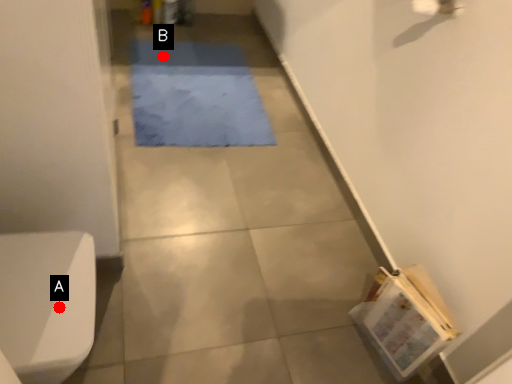
Question: Two points are circled on the image, labeled by A and B beside each circle. Among these points, which one is nearest to the camera?

Choices:
 (A) A is closer
 (B) B is closer

Answer: (A)